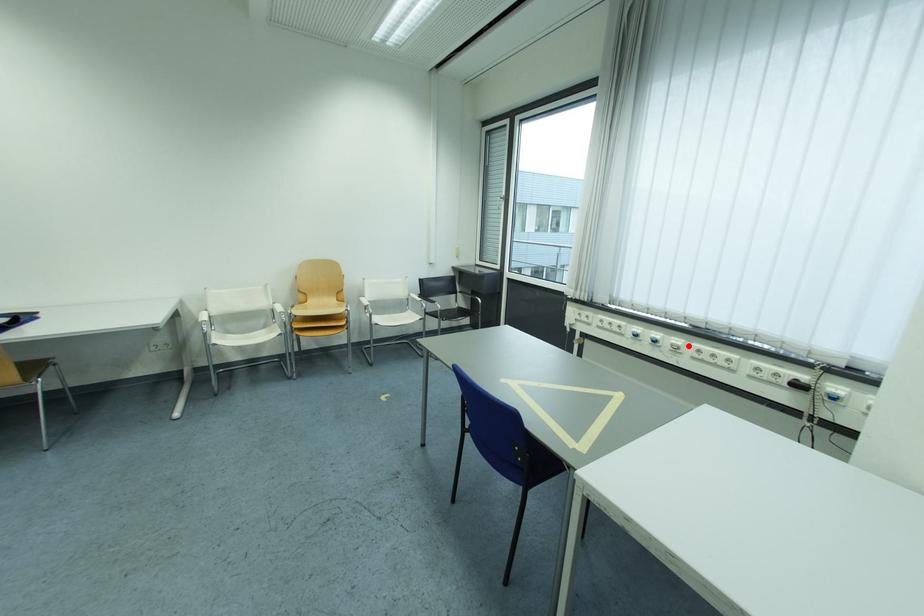
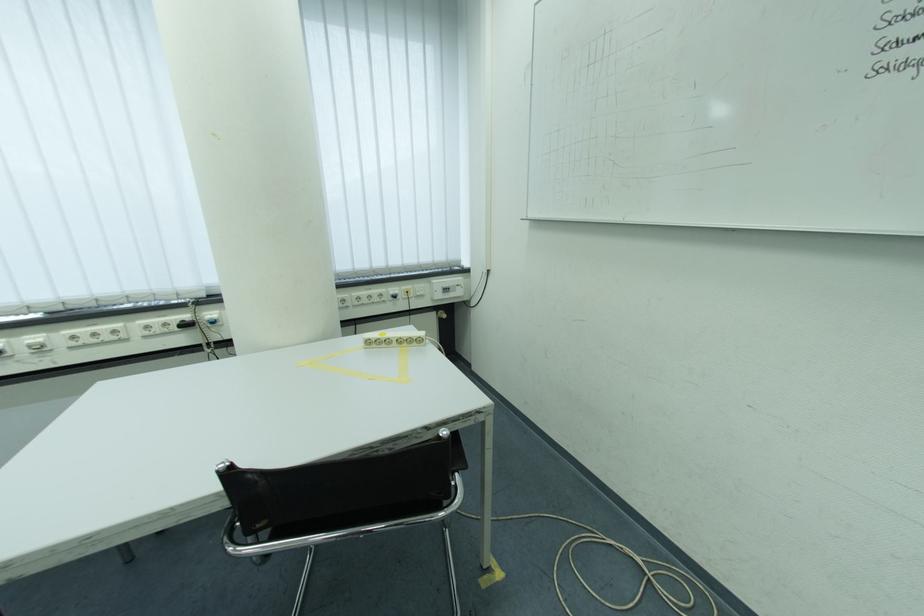
Where in the second image is the point corresponding to the highlighted location from the first image?

(50, 342)